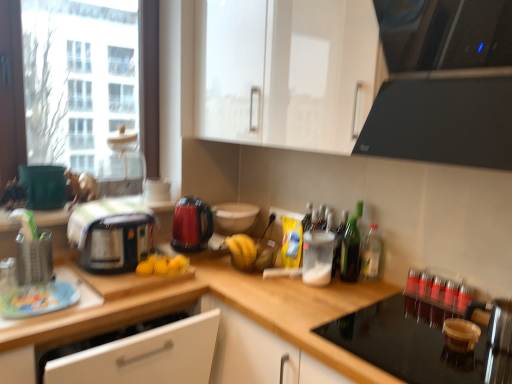
Question: Can you confirm if wooden at center, placed as the 2th countertop when sorted from left to right, is positioned to the right of black glass cooktop at upper right?

Choices:
 (A) no
 (B) yes

Answer: (A)

Question: Is wooden at center, acting as the first countertop starting from the right, closer to the viewer compared to black glass cooktop at upper right?

Choices:
 (A) no
 (B) yes

Answer: (A)

Question: Is wooden at center, acting as the first countertop starting from the right, smaller than black glass cooktop at upper right?

Choices:
 (A) no
 (B) yes

Answer: (A)

Question: Are wooden at center, acting as the first countertop starting from the right, and black glass cooktop at upper right located far from each other?

Choices:
 (A) no
 (B) yes

Answer: (A)

Question: Can you confirm if wooden at center, acting as the first countertop starting from the right, is shorter than black glass cooktop at upper right?

Choices:
 (A) yes
 (B) no

Answer: (B)

Question: Is wooden at center, acting as the first countertop starting from the right, at the left side of black glass cooktop at upper right?

Choices:
 (A) no
 (B) yes

Answer: (B)

Question: Is metallic silver utensil holder at left, marked as the 4th appliance in a right-to-left arrangement, looking in the opposite direction of green matte bucket at left, the 1th appliance viewed from the left?

Choices:
 (A) no
 (B) yes

Answer: (A)

Question: Is the surface of metallic silver utensil holder at left, marked as the 4th appliance in a right-to-left arrangement, in direct contact with green matte bucket at left, the 1th appliance viewed from the left?

Choices:
 (A) no
 (B) yes

Answer: (A)

Question: Does metallic silver utensil holder at left, the second appliance viewed from the left, have a smaller size compared to green matte bucket at left, the 1th appliance viewed from the left?

Choices:
 (A) no
 (B) yes

Answer: (B)

Question: Would you say metallic silver utensil holder at left, the second appliance viewed from the left, is outside green matte bucket at left, the 1th appliance viewed from the left?

Choices:
 (A) no
 (B) yes

Answer: (B)

Question: From the image's perspective, does metallic silver utensil holder at left, marked as the 4th appliance in a right-to-left arrangement, appear lower than green matte bucket at left, which is counted as the fifth appliance, starting from the right?

Choices:
 (A) yes
 (B) no

Answer: (A)

Question: From a real-world perspective, is metallic silver utensil holder at left, marked as the 4th appliance in a right-to-left arrangement, over green matte bucket at left, which is counted as the fifth appliance, starting from the right?

Choices:
 (A) no
 (B) yes

Answer: (A)

Question: Are black plastic toaster at left, the second kitchen appliance in the right-to-left sequence, and white glossy cabinet at upper center located far from each other?

Choices:
 (A) yes
 (B) no

Answer: (B)